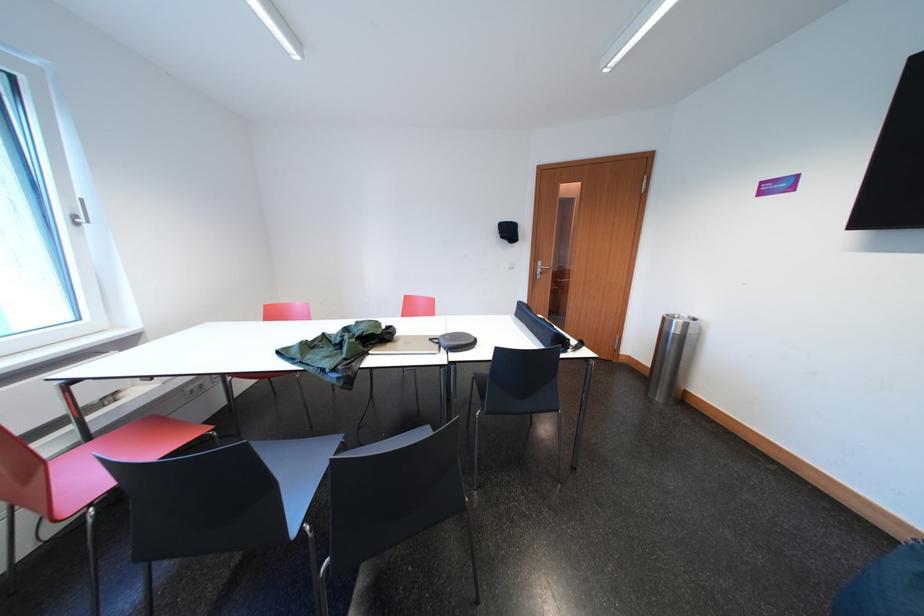
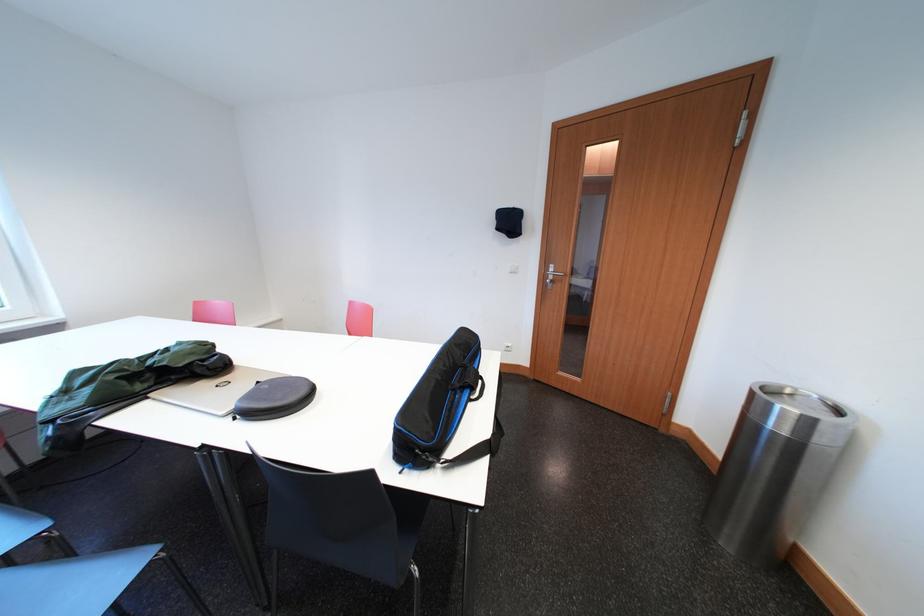
In the second image, find the point that corresponds to the point at 512,241 in the first image.

(506, 233)